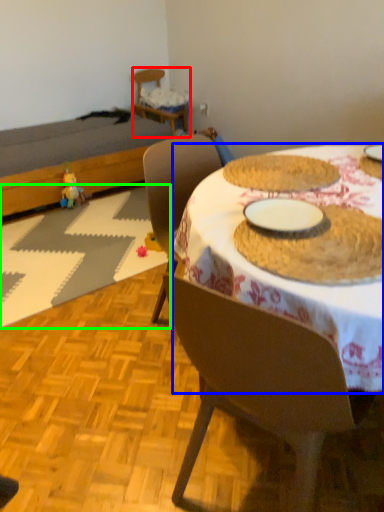
Question: Based on their relative distances, which object is nearer to chair (highlighted by a red box)? Choose from desk (highlighted by a blue box) and place mat (highlighted by a green box).

Choices:
 (A) desk
 (B) place mat

Answer: (B)